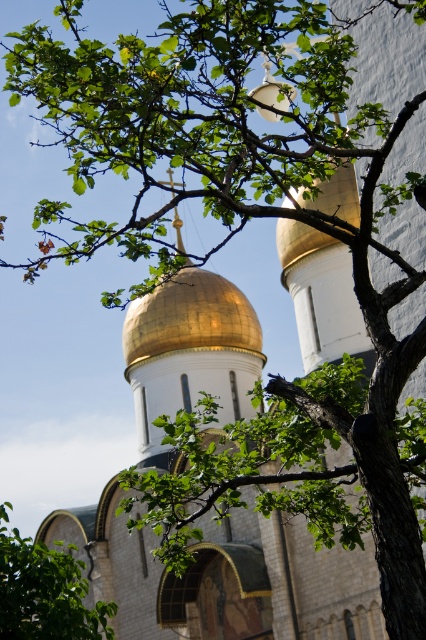
Question: Does gold polished dome at center have a larger size compared to green leafy branch at lower left?

Choices:
 (A) no
 (B) yes

Answer: (A)

Question: Which of the following is the closest to the observer?

Choices:
 (A) gold polished dome at center
 (B) green leafy branch at lower left

Answer: (B)

Question: Is gold polished dome at center to the right of green leafy branch at lower left from the viewer's perspective?

Choices:
 (A) no
 (B) yes

Answer: (B)

Question: Does gold polished dome at center appear over green leafy branch at lower left?

Choices:
 (A) yes
 (B) no

Answer: (A)